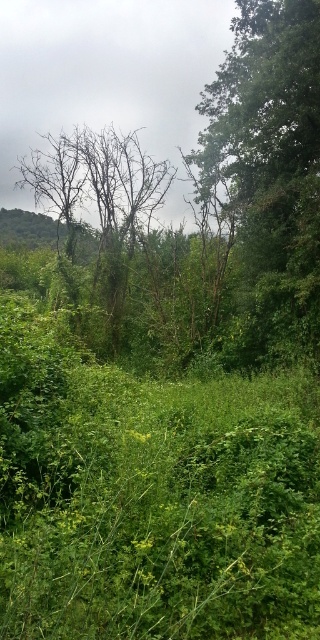
Is point (318, 232) positioned before point (97, 214)?

Yes, point (318, 232) is closer to viewer.

Does green leafy tree at upper right have a larger size compared to bare branches at center?

Yes.

Does point (268, 216) come behind point (140, 164)?

No, (268, 216) is in front of (140, 164).

The width and height of the screenshot is (320, 640). Find the location of `green leafy tree at upper right`. green leafy tree at upper right is located at coordinates (270, 170).